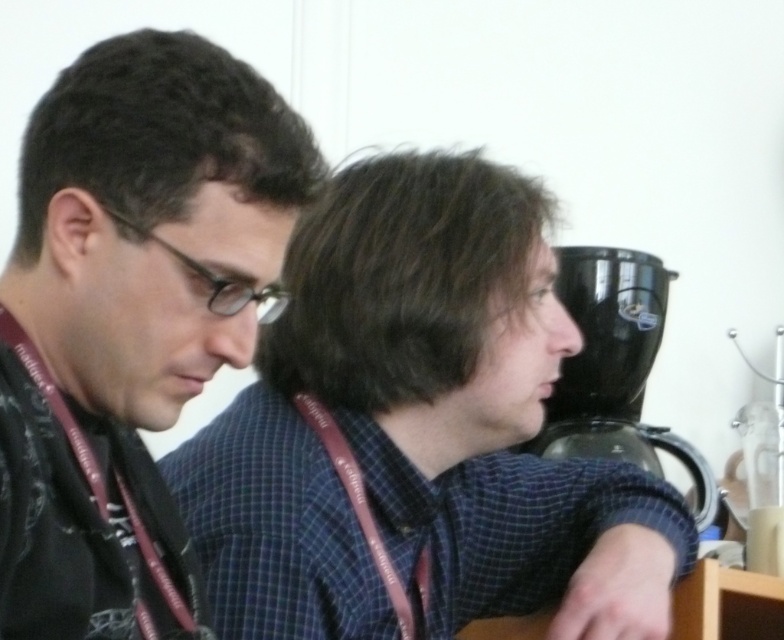
You are standing in a room with a matte black shirt at left and a black plastic coffee machine at right. If you want to get a coffee, which object should you approach?

The black plastic coffee machine at right is the correct object to approach for getting coffee, as it is a coffee machine located to the right of the matte black shirt at left.

Looking at this image, you are a photographer setting up a shoot in this scene. You want to take a photo that focuses on the blue checkered shirt at center while keeping the matte black shirt at left visible in the background. Is the current arrangement suitable for this composition?

Yes, the current arrangement is suitable because the blue checkered shirt at center is closer to the viewer than the matte black shirt at left, allowing it to be the focal point while the matte black shirt at left remains visible in the background.

You are a service robot with a 20 inch wide tray. You need to move your tray between the blue checkered shirt at center and the black plastic coffee machine at right. Can your tray fit through the space between them?

The blue checkered shirt at center and black plastic coffee machine at right are 20.10 inches apart from each other. Since the tray is 20 inches wide, it can fit through the space between them as the distance is slightly larger than the tray.